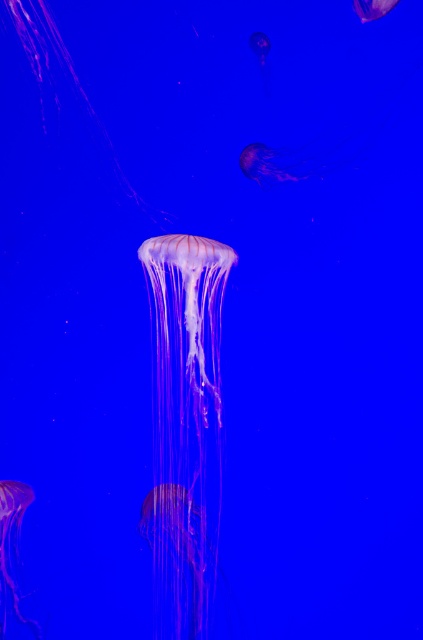
You are an underwater photographer aiming to capture the translucent pink jellyfish at center and the translucent purple jellyfish at upper right in the same frame. Based on their positions, which jellyfish is closer to the left edge of your camera view?

The translucent pink jellyfish at center is positioned on the left side of the translucent purple jellyfish at upper right, so it is closer to the left edge of the camera view.

You are an underwater photographer aiming to capture the translucent pink jellyfish at lower left in your shot. Your camera has a focus point at coordinate 0.856, 0.031. Will this focus point align with the jellyfish?

Yes, the translucent pink jellyfish at lower left is positioned exactly at point (13, 547), so the focus point will align perfectly with it.